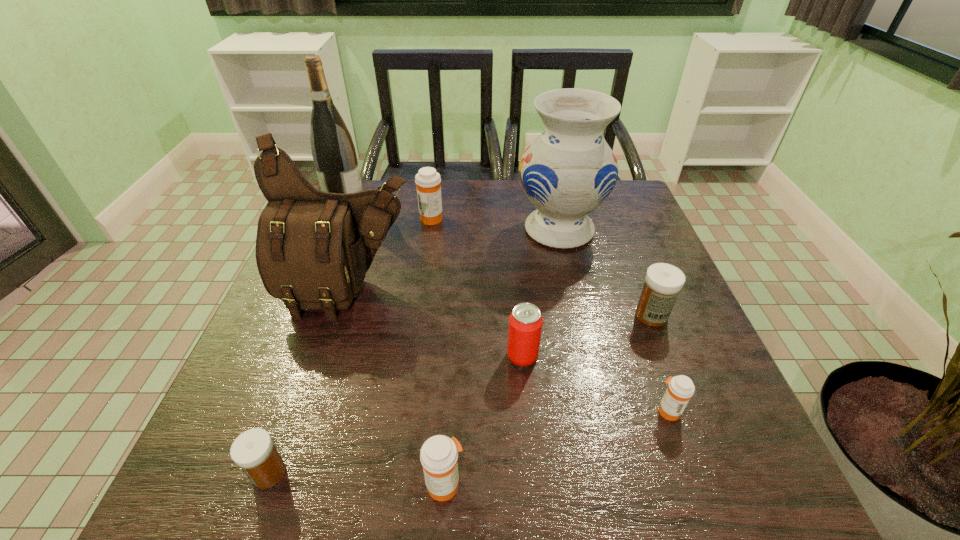
This screenshot has width=960, height=540. I want to click on wine bottle, so click(x=333, y=151).

The height and width of the screenshot is (540, 960). Identify the location of red vase. pyautogui.click(x=569, y=170).

This screenshot has height=540, width=960. Identify the location of shoulder bag. (313, 248).

You are a GUI agent. You are given a task and a screenshot of the screen. Output one action in this format:
    pyautogui.click(x=<x>, y=<y>)
    Task: Click on the farthest medicine
    Image resolution: width=960 pixels, height=540 pixels.
    Given the screenshot: What is the action you would take?
    pyautogui.click(x=428, y=181)

Where is `the farthest orange medicine`? This screenshot has height=540, width=960. the farthest orange medicine is located at coordinates (428, 181).

Identify the location of the fourth nearest object. (525, 322).

Find the location of `beer can`. beer can is located at coordinates coord(525,322).

At what (x,y) coordinates should I click in order to perform the action: click on the farther white medicine. Please return your answer as a coordinate pair (x, y). This screenshot has height=540, width=960. Looking at the image, I should click on (663, 282).

This screenshot has height=540, width=960. What are the coordinates of `the bigger white medicine` in the screenshot? It's located at (663, 282).

Image resolution: width=960 pixels, height=540 pixels. I want to click on the fifth object from right to left, so click(x=439, y=454).